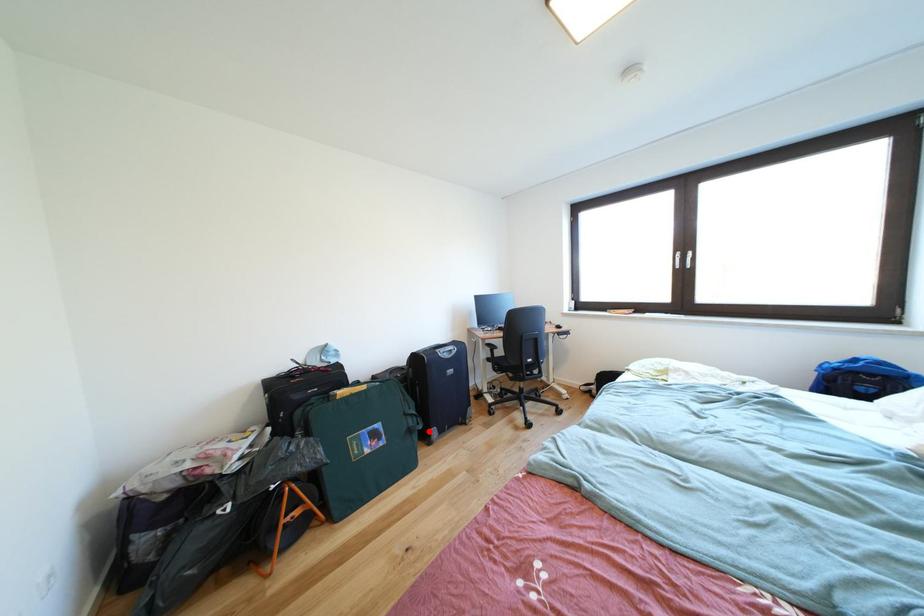
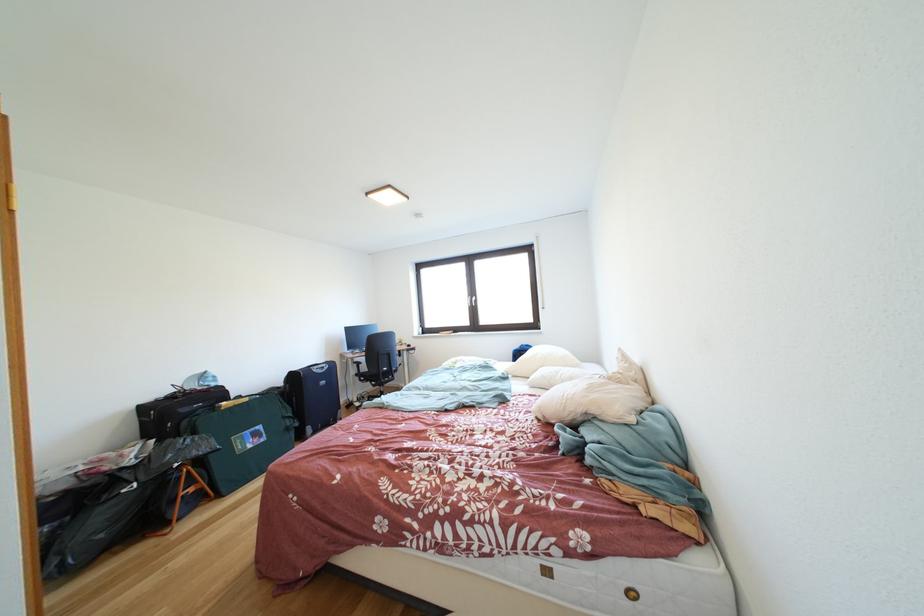
Question: I am providing you with two images of the same scene from different viewpoints. Image1 has a red point marked. In image2, the corresponding 3D location appears at what relative position? Reply with the corresponding letter.

Choices:
 (A) Closer
 (B) Farther

Answer: (A)